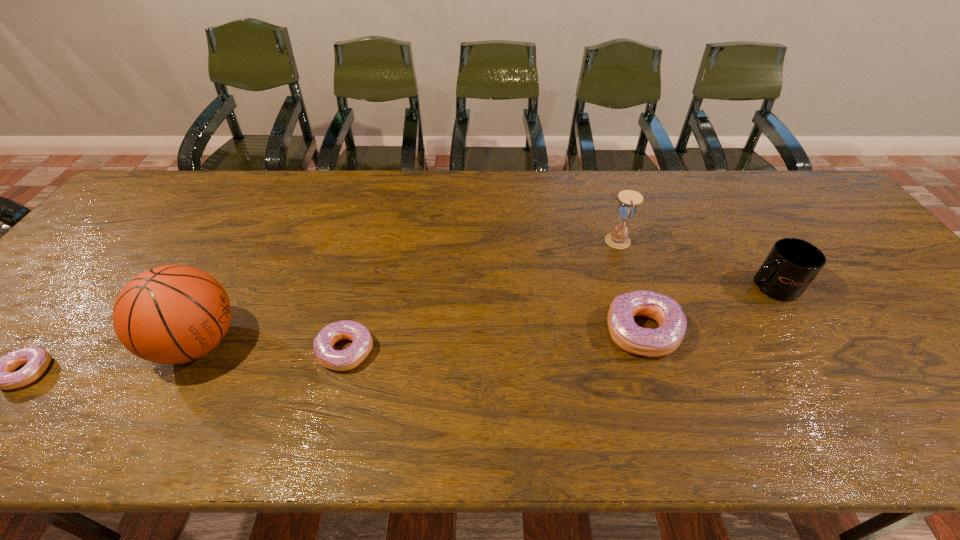
Identify the location of the fifth tallest object. (340, 360).

Locate an element on the screen. The width and height of the screenshot is (960, 540). the third object from left to right is located at coordinates (340, 360).

I want to click on the rightmost doughnut, so click(x=630, y=337).

The width and height of the screenshot is (960, 540). I want to click on the tallest doughnut, so click(x=630, y=337).

You are a GUI agent. You are given a task and a screenshot of the screen. Output one action in this format:
    pyautogui.click(x=<x>, y=<y>)
    Task: Click on the rightmost object
    The image size is (960, 540).
    Given the screenshot: What is the action you would take?
    pyautogui.click(x=792, y=264)

At what (x,y) coordinates should I click in order to perform the action: click on the fifth nearest object. Please return your answer as a coordinate pair (x, y). This screenshot has width=960, height=540. Looking at the image, I should click on (792, 264).

Image resolution: width=960 pixels, height=540 pixels. Identify the location of the second tallest object. (619, 237).

Where is `the farthest object`? This screenshot has width=960, height=540. the farthest object is located at coordinates (619, 237).

Locate an element on the screen. the tallest object is located at coordinates (172, 314).

Identify the location of basketball. The width and height of the screenshot is (960, 540). pos(172,314).